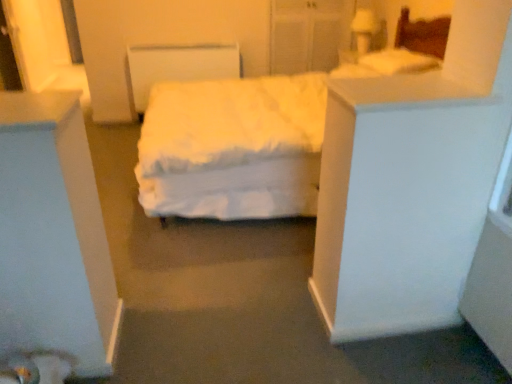
Question: Do you think white soft pillow at upper right is within white soft bed at center, or outside of it?

Choices:
 (A) inside
 (B) outside

Answer: (A)

Question: Is white soft pillow at upper right taller or shorter than white soft bed at center?

Choices:
 (A) tall
 (B) short

Answer: (B)

Question: From the image's perspective, relative to white soft bed at center, is white soft pillow at upper right above or below?

Choices:
 (A) above
 (B) below

Answer: (A)

Question: From the image's perspective, is white soft bed at center above or below white soft pillow at upper right?

Choices:
 (A) above
 (B) below

Answer: (B)

Question: From a real-world perspective, is white soft bed at center physically located above or below white soft pillow at upper right?

Choices:
 (A) above
 (B) below

Answer: (B)

Question: In terms of height, does white soft bed at center look taller or shorter compared to white soft pillow at upper right?

Choices:
 (A) short
 (B) tall

Answer: (B)

Question: Considering the positions of white soft bed at center and white soft pillow at upper right in the image, is white soft bed at center bigger or smaller than white soft pillow at upper right?

Choices:
 (A) small
 (B) big

Answer: (B)